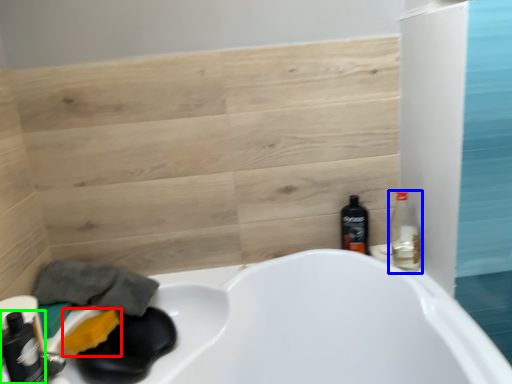
Question: Considering the real-world distances, which object is closest to soap (highlighted by a red box)? bottle (highlighted by a blue box) or bottle (highlighted by a green box).

Choices:
 (A) bottle
 (B) bottle

Answer: (B)